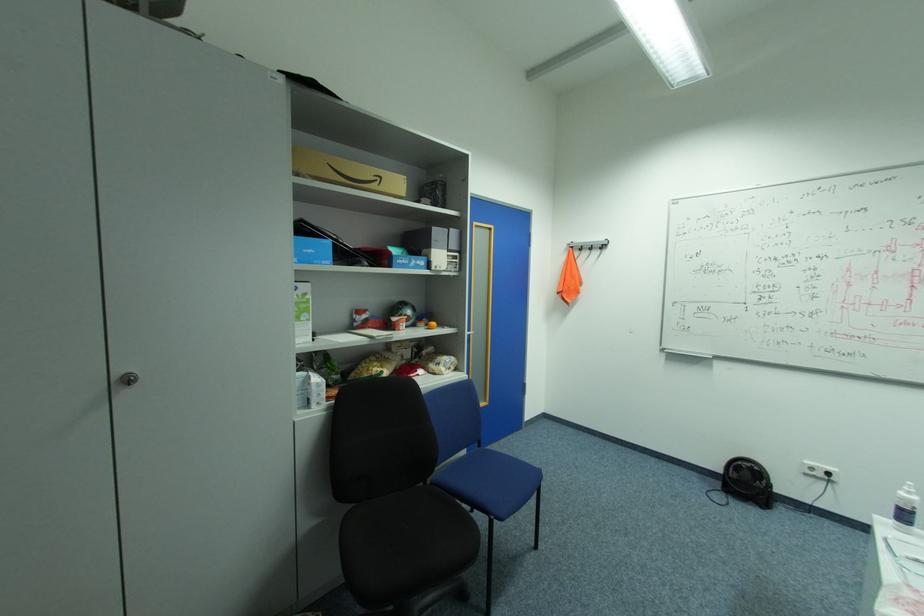
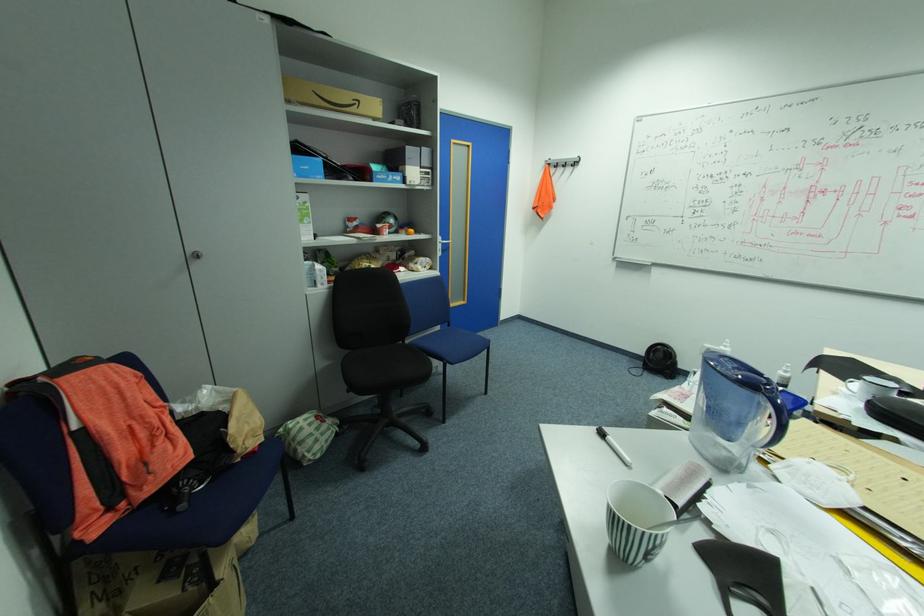
Question: The images are taken continuously from a first-person perspective. In which direction is your viewpoint rotating?

Choices:
 (A) Left
 (B) Right
 (C) Up
 (D) Down

Answer: (D)